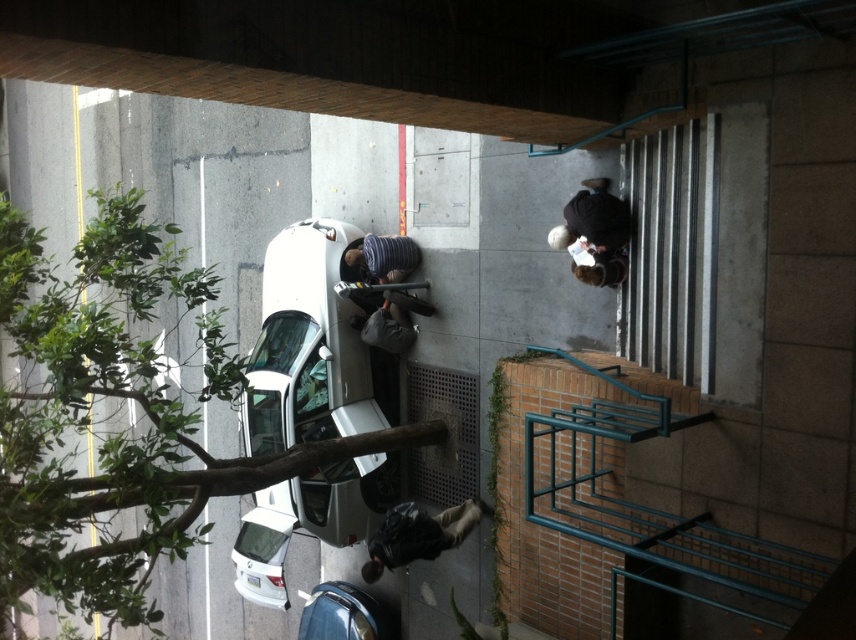
You are standing on the balcony looking down at the street. You see a white metallic car at center and a white matte car at lower left. Which car is closer to the staircase on the right side of the image?

The white metallic car at center is closer to the staircase on the right side of the image because it is positioned to the right of the white matte car at lower left.

Based on the photo, you are a delivery person trying to deliver a package to the address located at the base of the staircase on the right. You have a black matte jacket at lower center and a metallic blue car at lower center in your view. Which object is taller and could potentially block your line of sight to the staircase?

The black matte jacket at lower center is taller than the metallic blue car at lower center, so it could potentially block your line of sight to the staircase.

You are standing on the balcony looking down at the street. You see a green leafy tree at lower left and a white metallic car at center. Which object is closer to you, the observer?

The green leafy tree at lower left is closer to you because it is positioned below the white metallic car at center, indicating it is nearer in the visual hierarchy.